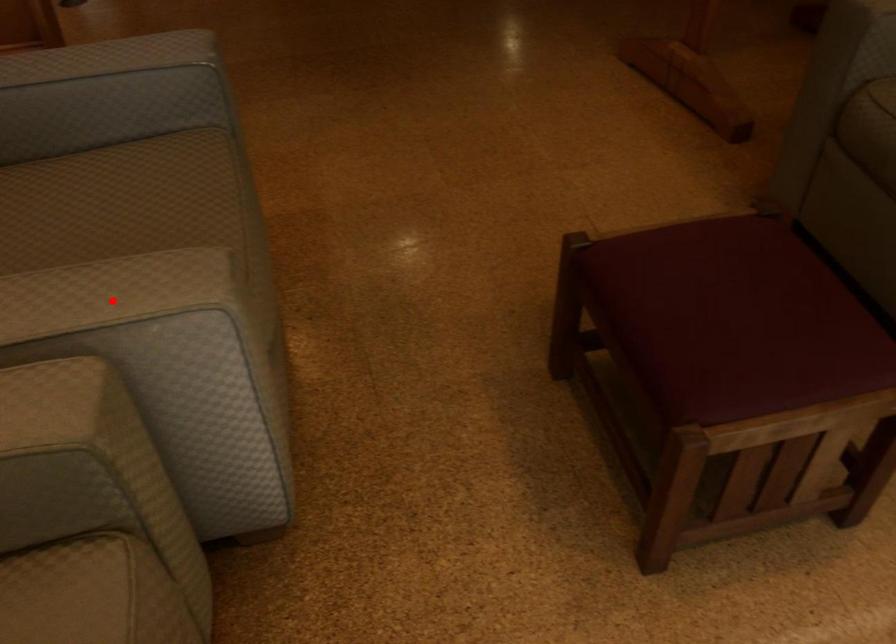
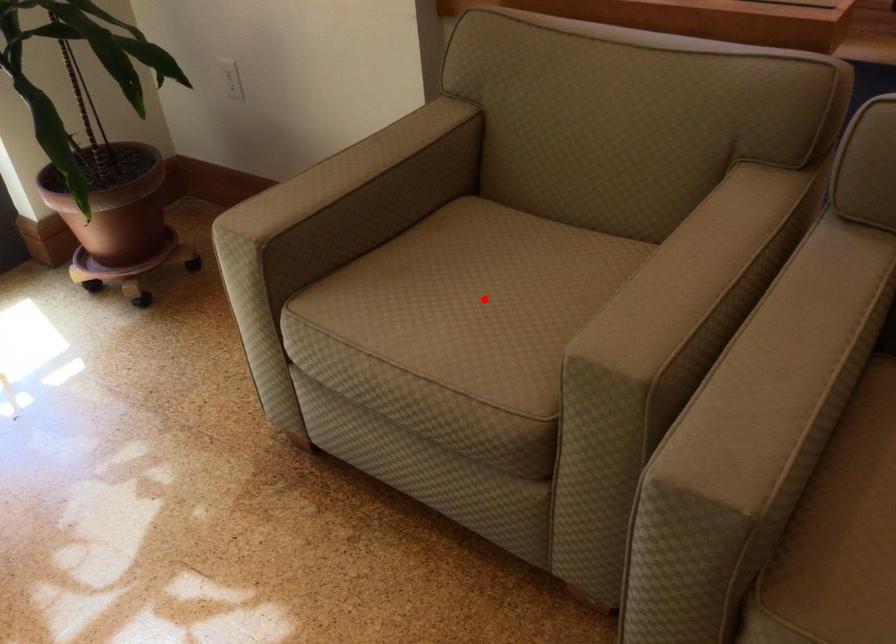
I am providing you with two images of the same scene from different viewpoints. A red point is marked on the first image and another point is marked on the second image. Is the marked point in image1 the same physical position as the marked point in image2?

No